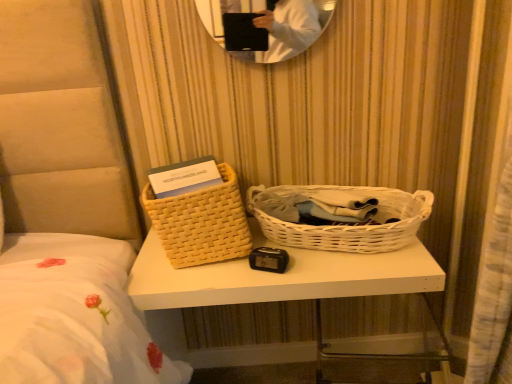
Question: Does white wicker picnic basket at center, placed as the second picnic basket when sorted from left to right, have a lesser width compared to woven beige basket at left, which appears as the 1th picnic basket when viewed from the left?

Choices:
 (A) yes
 (B) no

Answer: (B)

Question: Is white wicker picnic basket at center, which is counted as the 1th picnic basket, starting from the right, directly adjacent to woven beige basket at left, which appears as the 1th picnic basket when viewed from the left?

Choices:
 (A) no
 (B) yes

Answer: (A)

Question: Does white wicker picnic basket at center, placed as the second picnic basket when sorted from left to right, have a smaller size compared to woven beige basket at left, which appears as the 1th picnic basket when viewed from the left?

Choices:
 (A) no
 (B) yes

Answer: (A)

Question: Would you say white wicker picnic basket at center, placed as the second picnic basket when sorted from left to right, is a long distance from woven beige basket at left, which appears as the 1th picnic basket when viewed from the left?

Choices:
 (A) yes
 (B) no

Answer: (B)

Question: Can you confirm if white wicker picnic basket at center, placed as the second picnic basket when sorted from left to right, is positioned to the right of woven beige basket at left, which appears as the second picnic basket when viewed from the right?

Choices:
 (A) yes
 (B) no

Answer: (A)

Question: Is point (174, 286) positioned closer to the camera than point (295, 246)?

Choices:
 (A) farther
 (B) closer

Answer: (B)

Question: Considering the positions of white woven basket at center and white wicker picnic basket at center, placed as the second picnic basket when sorted from left to right, in the image, is white woven basket at center taller or shorter than white wicker picnic basket at center, placed as the second picnic basket when sorted from left to right,?

Choices:
 (A) short
 (B) tall

Answer: (B)

Question: From a real-world perspective, is white woven basket at center positioned above or below white wicker picnic basket at center, placed as the second picnic basket when sorted from left to right?

Choices:
 (A) below
 (B) above

Answer: (A)

Question: Is white woven basket at center inside the boundaries of white wicker picnic basket at center, which is counted as the 1th picnic basket, starting from the right, or outside?

Choices:
 (A) outside
 (B) inside

Answer: (A)

Question: Does point (429, 196) appear closer or farther from the camera than point (227, 165)?

Choices:
 (A) farther
 (B) closer

Answer: (B)

Question: From a real-world perspective, relative to woven beige basket at left, which appears as the 1th picnic basket when viewed from the left, is white wicker picnic basket at center, which is counted as the 1th picnic basket, starting from the right, vertically above or below?

Choices:
 (A) below
 (B) above

Answer: (A)

Question: Is white wicker picnic basket at center, which is counted as the 1th picnic basket, starting from the right, wider or thinner than woven beige basket at left, which appears as the 1th picnic basket when viewed from the left?

Choices:
 (A) wide
 (B) thin

Answer: (A)

Question: Relative to woven beige basket at left, which appears as the second picnic basket when viewed from the right, is white wicker picnic basket at center, placed as the second picnic basket when sorted from left to right, in front or behind?

Choices:
 (A) front
 (B) behind

Answer: (A)

Question: In the image, is woven beige basket at left, which appears as the 1th picnic basket when viewed from the left, on the left side or the right side of white woven basket at center?

Choices:
 (A) left
 (B) right

Answer: (A)

Question: Would you say woven beige basket at left, which appears as the 1th picnic basket when viewed from the left, is inside or outside white woven basket at center?

Choices:
 (A) inside
 (B) outside

Answer: (B)